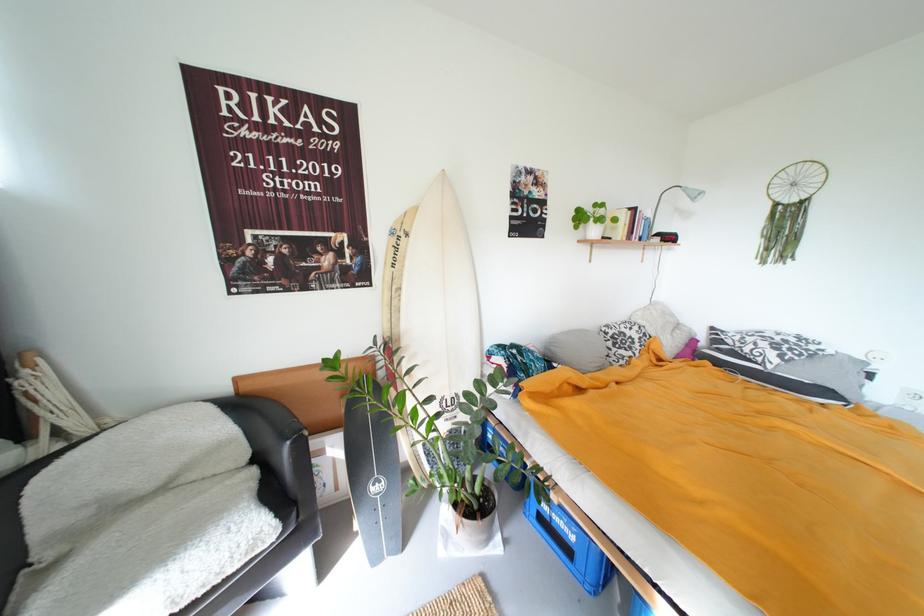
Where would you lift the digital clock? Please return your answer as a coordinate pair (x, y).

(667, 238)